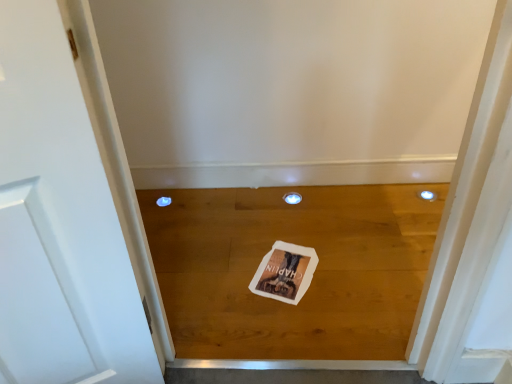
At what (x,y) coordinates should I click in order to perform the action: click on free spot behind white paper postcard at center. Please return your answer as a coordinate pair (x, y). The image size is (512, 384). Looking at the image, I should click on (278, 226).